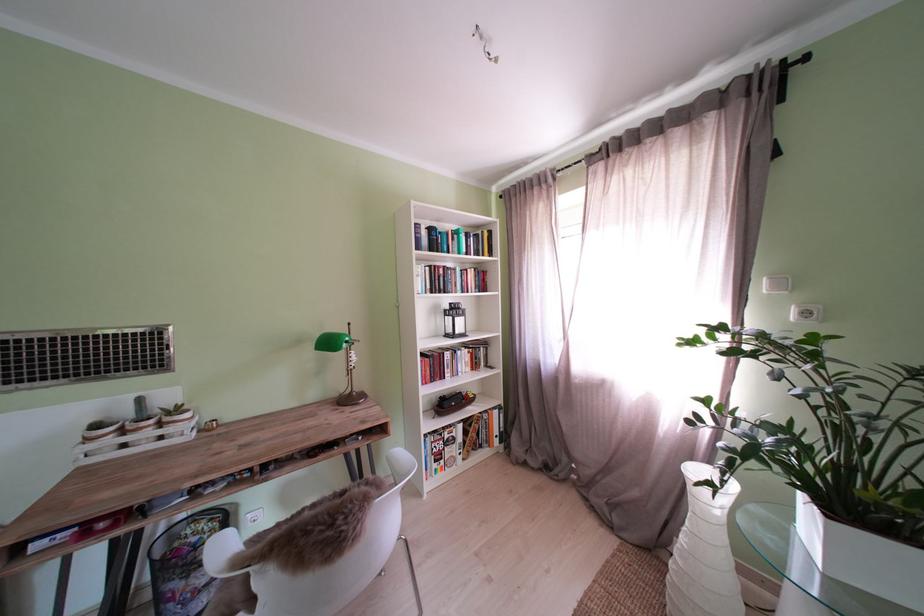
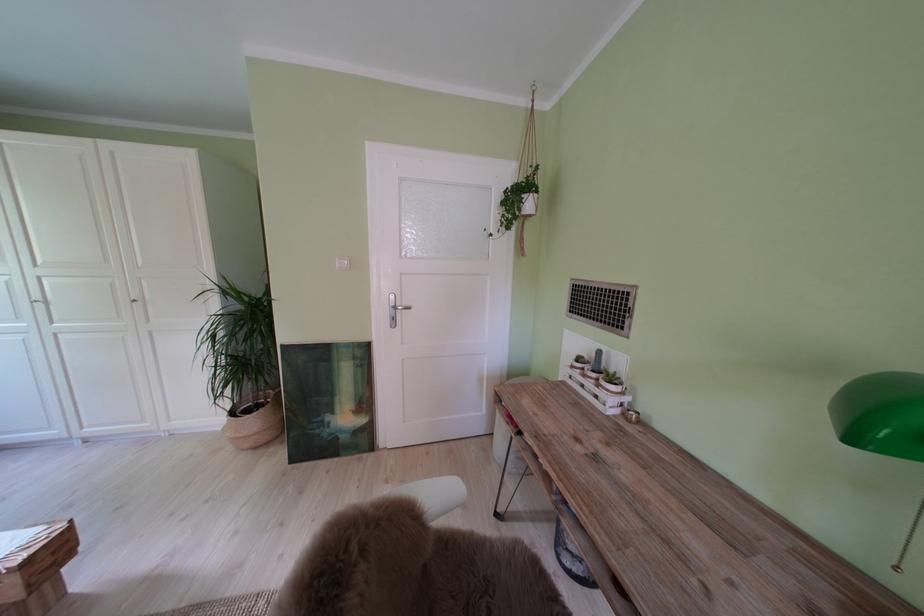
Question: The camera is either moving clockwise (left) or counter-clockwise (right) around the object. The first image is from the beginning of the video and the second image is from the end. Is the camera moving left or right when shooting the video?

Choices:
 (A) Left
 (B) Right

Answer: (B)